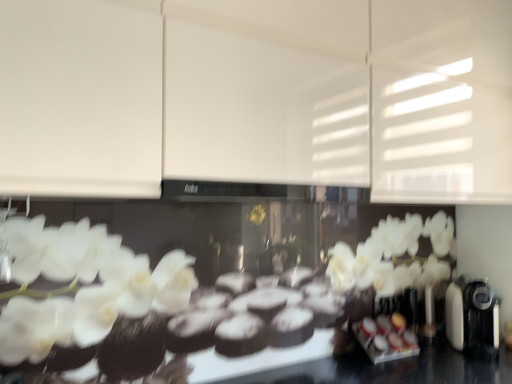
Question: Is black plastic coffee machine at right a part of white glossy canisters at center?

Choices:
 (A) yes
 (B) no

Answer: (B)

Question: Is white glossy canisters at center to the right of black plastic coffee machine at right from the viewer's perspective?

Choices:
 (A) yes
 (B) no

Answer: (B)

Question: Is white glossy canisters at center facing towards black plastic coffee machine at right?

Choices:
 (A) yes
 (B) no

Answer: (B)

Question: Is white glossy canisters at center at the left side of black plastic coffee machine at right?

Choices:
 (A) yes
 (B) no

Answer: (A)

Question: Is white glossy canisters at center thinner than black plastic coffee machine at right?

Choices:
 (A) yes
 (B) no

Answer: (A)

Question: Considering the positions of black plastic coffee machine at right and white matte cabinet at upper center in the image, is black plastic coffee machine at right taller or shorter than white matte cabinet at upper center?

Choices:
 (A) short
 (B) tall

Answer: (A)

Question: In the image, is black plastic coffee machine at right positioned in front of or behind white matte cabinet at upper center?

Choices:
 (A) front
 (B) behind

Answer: (B)

Question: From the image's perspective, relative to white matte cabinet at upper center, is black plastic coffee machine at right above or below?

Choices:
 (A) above
 (B) below

Answer: (B)

Question: Is black plastic coffee machine at right bigger or smaller than white matte cabinet at upper center?

Choices:
 (A) big
 (B) small

Answer: (B)

Question: Is white glossy canisters at center inside the boundaries of black plastic coffee machine at right, or outside?

Choices:
 (A) outside
 (B) inside

Answer: (A)

Question: From the image's perspective, is white glossy canisters at center located above or below black plastic coffee machine at right?

Choices:
 (A) below
 (B) above

Answer: (A)

Question: From a real-world perspective, relative to black plastic coffee machine at right, is white glossy canisters at center vertically above or below?

Choices:
 (A) below
 (B) above

Answer: (A)

Question: Is white glossy canisters at center taller or shorter than black plastic coffee machine at right?

Choices:
 (A) short
 (B) tall

Answer: (A)

Question: From the image's perspective, is black plastic coffee machine at right located above or below white glossy canisters at center?

Choices:
 (A) below
 (B) above

Answer: (B)

Question: Is black plastic coffee machine at right bigger or smaller than white glossy canisters at center?

Choices:
 (A) small
 (B) big

Answer: (B)